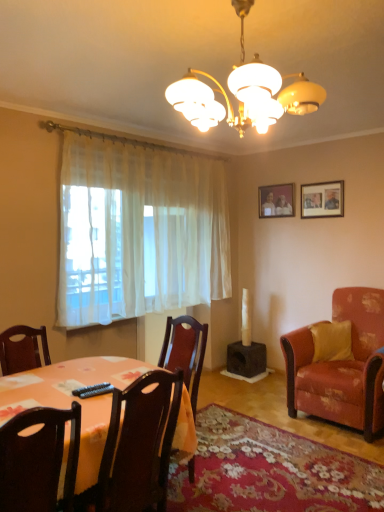
Question: Is the depth of dark wood chair at lower left, which ranks as the third chair in back-to-front order, less than that of velvet orange armchair at right, the first chair when ordered from right to left?

Choices:
 (A) no
 (B) yes

Answer: (B)

Question: From a real-world perspective, is dark wood chair at lower left, which is the 3th chair from right to left, beneath velvet orange armchair at right, positioned as the third chair in front-to-back order?

Choices:
 (A) yes
 (B) no

Answer: (B)

Question: Is dark wood chair at lower left, which ranks as the third chair in back-to-front order, behind velvet orange armchair at right, which is counted as the 3th chair, starting from the left?

Choices:
 (A) no
 (B) yes

Answer: (A)

Question: From the image's perspective, would you say dark wood chair at lower left, which is the first chair from front to back, is positioned over velvet orange armchair at right, which appears as the first chair when viewed from the back?

Choices:
 (A) yes
 (B) no

Answer: (A)

Question: Is dark wood chair at lower left, which ranks as the third chair in back-to-front order, aimed at velvet orange armchair at right, the first chair when ordered from right to left?

Choices:
 (A) yes
 (B) no

Answer: (B)

Question: Would you say dark wood chair at lower left, marked as the 1th chair in a left-to-right arrangement, contains velvet orange armchair at right, the first chair when ordered from right to left?

Choices:
 (A) no
 (B) yes

Answer: (A)

Question: Can you confirm if dark wood chair at center, the second chair when ordered from front to back, is shorter than white sheer curtain at left?

Choices:
 (A) no
 (B) yes

Answer: (B)

Question: From a real-world perspective, is dark wood chair at center, which appears as the 2th chair when viewed from the back, on top of white sheer curtain at left?

Choices:
 (A) yes
 (B) no

Answer: (B)

Question: From the image's perspective, would you say dark wood chair at center, which appears as the 2th chair when viewed from the back, is positioned over white sheer curtain at left?

Choices:
 (A) yes
 (B) no

Answer: (B)

Question: Would you say white sheer curtain at left is part of dark wood chair at center, the second chair viewed from the right,'s contents?

Choices:
 (A) no
 (B) yes

Answer: (A)

Question: Are dark wood chair at center, the 2th chair viewed from the left, and white sheer curtain at left beside each other?

Choices:
 (A) yes
 (B) no

Answer: (B)

Question: Is the position of dark wood chair at center, which appears as the 2th chair when viewed from the back, more distant than that of white sheer curtain at left?

Choices:
 (A) yes
 (B) no

Answer: (B)

Question: From a real-world perspective, is velvet orange armchair at right, which appears as the first chair when viewed from the back, positioned over white sheer curtain at left based on gravity?

Choices:
 (A) no
 (B) yes

Answer: (A)